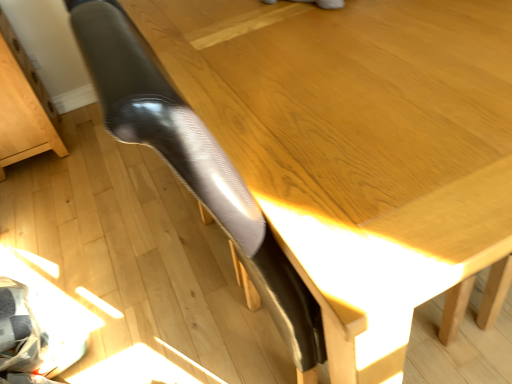
Question: Can you see light brown wood drawer at lower left touching glossy black chair leg at center?

Choices:
 (A) yes
 (B) no

Answer: (B)

Question: From a real-world perspective, is light brown wood drawer at lower left under glossy black chair leg at center?

Choices:
 (A) no
 (B) yes

Answer: (B)

Question: From the image's perspective, is light brown wood drawer at lower left above glossy black chair leg at center?

Choices:
 (A) yes
 (B) no

Answer: (A)

Question: From a real-world perspective, is light brown wood drawer at lower left over glossy black chair leg at center?

Choices:
 (A) no
 (B) yes

Answer: (A)

Question: Can you confirm if light brown wood drawer at lower left is shorter than glossy black chair leg at center?

Choices:
 (A) yes
 (B) no

Answer: (A)

Question: Considering the relative sizes of light brown wood drawer at lower left and glossy black chair leg at center in the image provided, is light brown wood drawer at lower left taller than glossy black chair leg at center?

Choices:
 (A) no
 (B) yes

Answer: (A)

Question: Can you confirm if glossy black chair leg at center is taller than light brown wood drawer at lower left?

Choices:
 (A) no
 (B) yes

Answer: (B)

Question: From a real-world perspective, is glossy black chair leg at center on light brown wood drawer at lower left?

Choices:
 (A) yes
 (B) no

Answer: (A)

Question: Does glossy black chair leg at center have a smaller size compared to light brown wood drawer at lower left?

Choices:
 (A) no
 (B) yes

Answer: (A)

Question: From the image's perspective, does glossy black chair leg at center appear lower than light brown wood drawer at lower left?

Choices:
 (A) no
 (B) yes

Answer: (B)

Question: Is glossy black chair leg at center looking in the opposite direction of light brown wood drawer at lower left?

Choices:
 (A) yes
 (B) no

Answer: (B)

Question: Can you confirm if glossy black chair leg at center is thinner than light brown wood drawer at lower left?

Choices:
 (A) no
 (B) yes

Answer: (B)

Question: Relative to glossy black chair leg at center, is light brown wood drawer at lower left in front or behind?

Choices:
 (A) front
 (B) behind

Answer: (B)